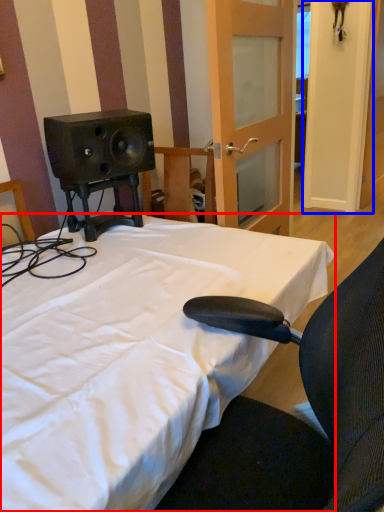
Question: Among these objects, which one is farthest to the camera, bed (highlighted by a red box) or door (highlighted by a blue box)?

Choices:
 (A) bed
 (B) door

Answer: (B)